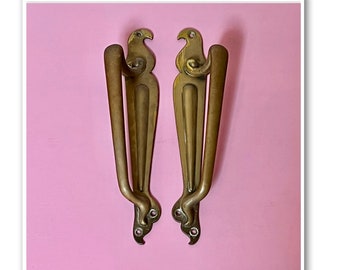
The height and width of the screenshot is (270, 340). Identify the location of handles. (218, 81), (118, 102).